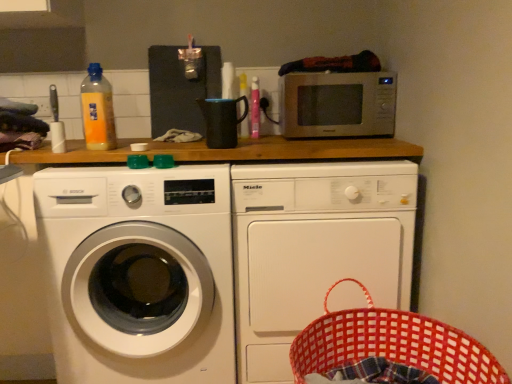
What do you see at coordinates (314, 248) in the screenshot? I see `white matte washing machine at center, which appears as the first washing machine when viewed from the right` at bounding box center [314, 248].

How much space does white glossy washing machine at left, arranged as the first washing machine when viewed from the left, occupy horizontally?

white glossy washing machine at left, arranged as the first washing machine when viewed from the left, is 86.07 centimeters in width.

The image size is (512, 384). In order to click on red woven basket at lower right in this screenshot , I will do `click(392, 344)`.

In the scene shown: Measure the distance between point (87, 128) and camera.

A distance of 4.69 feet exists between point (87, 128) and camera.

Locate an element on the screen. white matte washing machine at center, which appears as the first washing machine when viewed from the right is located at coordinates (314, 248).

Which of these two, red woven basket at lower right or satin silver microwave at upper center, is thinner?

satin silver microwave at upper center is thinner.

Considering the positions of objects red woven basket at lower right and satin silver microwave at upper center in the image provided, who is in front, red woven basket at lower right or satin silver microwave at upper center?

red woven basket at lower right is more forward.

Is red woven basket at lower right looking in the opposite direction of satin silver microwave at upper center?

red woven basket at lower right does not have its back to satin silver microwave at upper center.

From their relative heights in the image, would you say red woven basket at lower right is taller or shorter than satin silver microwave at upper center?

red woven basket at lower right is taller than satin silver microwave at upper center.

Which is behind, white matte washing machine at center, the 2th washing machine positioned from the left, or white glossy washing machine at left, arranged as the first washing machine when viewed from the left?

white matte washing machine at center, the 2th washing machine positioned from the left, is further from the camera.

Is white matte washing machine at center, which appears as the first washing machine when viewed from the right, oriented towards white glossy washing machine at left, arranged as the first washing machine when viewed from the left?

No.

From the image's perspective, who appears lower, white matte washing machine at center, the 2th washing machine positioned from the left, or white glossy washing machine at left, arranged as the first washing machine when viewed from the left?

white glossy washing machine at left, arranged as the first washing machine when viewed from the left.

From a real-world perspective, is white matte washing machine at center, the 2th washing machine positioned from the left, under white glossy washing machine at left, arranged as the first washing machine when viewed from the left?

Yes.

Which is more to the right, translucent plastic bottle at upper center, the 2th bottle from the front, or red woven basket at lower right?

red woven basket at lower right is more to the right.

Looking at their sizes, would you say translucent plastic bottle at upper center, the first bottle from the back, is wider or thinner than red woven basket at lower right?

Clearly, translucent plastic bottle at upper center, the first bottle from the back, has less width compared to red woven basket at lower right.

Is translucent plastic bottle at upper center, which ranks as the second bottle in left-to-right order, further to camera compared to red woven basket at lower right?

That is True.

From the image's perspective, relative to red woven basket at lower right, is translucent plastic bottle at upper center, the 2th bottle from the front, above or below?

Clearly, from the image's perspective, translucent plastic bottle at upper center, the 2th bottle from the front, is above red woven basket at lower right.

Which object is positioned more to the right, white matte washing machine at center, which appears as the first washing machine when viewed from the right, or satin silver microwave at upper center?

Positioned to the right is satin silver microwave at upper center.

Is white matte washing machine at center, which appears as the first washing machine when viewed from the right, completely or partially outside of satin silver microwave at upper center?

Yes, white matte washing machine at center, which appears as the first washing machine when viewed from the right, is located beyond the bounds of satin silver microwave at upper center.

Considering the positions of points (297, 183) and (374, 126), is point (297, 183) closer to camera compared to point (374, 126)?

Yes.

Can you tell me how much white matte washing machine at center, the 2th washing machine positioned from the left, and satin silver microwave at upper center differ in facing direction?

1.26 degrees separate the facing orientations of white matte washing machine at center, the 2th washing machine positioned from the left, and satin silver microwave at upper center.

Looking at their sizes, would you say translucent plastic bottle at upper center, marked as the first bottle in a right-to-left arrangement, is wider or thinner than yellow translucent bottle at upper left, which is counted as the first bottle, starting from the left?

In the image, translucent plastic bottle at upper center, marked as the first bottle in a right-to-left arrangement, appears to be more narrow than yellow translucent bottle at upper left, which is counted as the first bottle, starting from the left.

Is translucent plastic bottle at upper center, which ranks as the second bottle in left-to-right order, located outside yellow translucent bottle at upper left, the 2th bottle positioned from the right?

translucent plastic bottle at upper center, which ranks as the second bottle in left-to-right order, lies outside yellow translucent bottle at upper left, the 2th bottle positioned from the right,'s area.

Which object is more forward, translucent plastic bottle at upper center, the 2th bottle from the front, or yellow translucent bottle at upper left, which is the 1th bottle in front-to-back order?

yellow translucent bottle at upper left, which is the 1th bottle in front-to-back order, is more forward.

From a real-world perspective, which is physically above, translucent plastic bottle at upper center, the 2th bottle from the front, or yellow translucent bottle at upper left, which is counted as the first bottle, starting from the left?

From a 3D spatial view, yellow translucent bottle at upper left, which is counted as the first bottle, starting from the left, is above.

From the picture: Is satin silver microwave at upper center at the back of translucent plastic bottle at upper center, the 2th bottle from the front?

No, translucent plastic bottle at upper center, the 2th bottle from the front, is not facing away from satin silver microwave at upper center.

Does translucent plastic bottle at upper center, marked as the first bottle in a right-to-left arrangement, have a smaller size compared to satin silver microwave at upper center?

Indeed, translucent plastic bottle at upper center, marked as the first bottle in a right-to-left arrangement, has a smaller size compared to satin silver microwave at upper center.

Between translucent plastic bottle at upper center, which ranks as the second bottle in left-to-right order, and satin silver microwave at upper center, which one appears on the left side from the viewer's perspective?

translucent plastic bottle at upper center, which ranks as the second bottle in left-to-right order.

From a real-world perspective, is translucent plastic bottle at upper center, which ranks as the second bottle in left-to-right order, beneath white glossy washing machine at left, the 2th washing machine from the right?

No, from a real-world perspective, translucent plastic bottle at upper center, which ranks as the second bottle in left-to-right order, is not below white glossy washing machine at left, the 2th washing machine from the right.

Considering the sizes of objects translucent plastic bottle at upper center, the first bottle from the back, and white glossy washing machine at left, the 2th washing machine from the right, in the image provided, who is shorter, translucent plastic bottle at upper center, the first bottle from the back, or white glossy washing machine at left, the 2th washing machine from the right,?

With less height is translucent plastic bottle at upper center, the first bottle from the back.

How much distance is there between translucent plastic bottle at upper center, marked as the first bottle in a right-to-left arrangement, and white glossy washing machine at left, the 2th washing machine from the right?

translucent plastic bottle at upper center, marked as the first bottle in a right-to-left arrangement, is 31.25 inches from white glossy washing machine at left, the 2th washing machine from the right.

Is translucent plastic bottle at upper center, the first bottle from the back, directly adjacent to white glossy washing machine at left, the 2th washing machine from the right?

No, translucent plastic bottle at upper center, the first bottle from the back, is not making contact with white glossy washing machine at left, the 2th washing machine from the right.

Where is `microwave oven on the right side of red woven basket at lower right`? microwave oven on the right side of red woven basket at lower right is located at coordinates (337, 104).

There is a white matte washing machine at center, which appears as the first washing machine when viewed from the right. Find the location of `washing machine above it (from a real-world perspective)`. washing machine above it (from a real-world perspective) is located at coordinates (139, 273).

When comparing their distances from white matte washing machine at center, which appears as the first washing machine when viewed from the right, does red woven basket at lower right or white glossy washing machine at left, arranged as the first washing machine when viewed from the left, seem closer?

red woven basket at lower right is positioned closer to the anchor white matte washing machine at center, which appears as the first washing machine when viewed from the right.

Looking at the image, which one is located further to translucent plastic bottle at upper center, marked as the first bottle in a right-to-left arrangement, satin silver microwave at upper center or white matte washing machine at center, the 2th washing machine positioned from the left?

white matte washing machine at center, the 2th washing machine positioned from the left, is positioned further to the anchor translucent plastic bottle at upper center, marked as the first bottle in a right-to-left arrangement.

Estimate the real-world distances between objects in this image. Which object is closer to translucent plastic bottle at upper center, the 2th bottle from the front, white glossy washing machine at left, the 2th washing machine from the right, or red woven basket at lower right?

Based on the image, white glossy washing machine at left, the 2th washing machine from the right, appears to be nearer to translucent plastic bottle at upper center, the 2th bottle from the front.

Estimate the real-world distances between objects in this image. Which object is further from white glossy washing machine at left, the 2th washing machine from the right, red woven basket at lower right or translucent plastic bottle at upper center, which ranks as the second bottle in left-to-right order?

translucent plastic bottle at upper center, which ranks as the second bottle in left-to-right order, lies further to white glossy washing machine at left, the 2th washing machine from the right, than the other object.

When comparing their distances from red woven basket at lower right, does translucent plastic bottle at upper center, the first bottle from the back, or white glossy washing machine at left, arranged as the first washing machine when viewed from the left, seem closer?

Based on the image, white glossy washing machine at left, arranged as the first washing machine when viewed from the left, appears to be nearer to red woven basket at lower right.

From the image, which object appears to be farther from white glossy washing machine at left, arranged as the first washing machine when viewed from the left, white matte washing machine at center, which appears as the first washing machine when viewed from the right, or satin silver microwave at upper center?

Based on the image, satin silver microwave at upper center appears to be further to white glossy washing machine at left, arranged as the first washing machine when viewed from the left.

Consider the image. Looking at the image, which one is located further to translucent plastic bottle at upper center, marked as the first bottle in a right-to-left arrangement, red woven basket at lower right or yellow translucent bottle at upper left, which is counted as the first bottle, starting from the left?

Based on the image, red woven basket at lower right appears to be further to translucent plastic bottle at upper center, marked as the first bottle in a right-to-left arrangement.

Looking at the image, which one is located closer to white matte washing machine at center, which appears as the first washing machine when viewed from the right, translucent plastic bottle at upper center, the 2th bottle from the front, or red woven basket at lower right?

The object closer to white matte washing machine at center, which appears as the first washing machine when viewed from the right, is red woven basket at lower right.

In order to click on microwave oven positioned between red woven basket at lower right and translucent plastic bottle at upper center, the first bottle from the back, from near to far in this screenshot , I will do `click(337, 104)`.

Image resolution: width=512 pixels, height=384 pixels. In order to click on bottle between yellow translucent bottle at upper left, the 2th bottle positioned from the right, and white matte washing machine at center, which appears as the first washing machine when viewed from the right, from left to right in this screenshot , I will do `click(243, 85)`.

Locate an element on the screen. The width and height of the screenshot is (512, 384). washing machine between white glossy washing machine at left, arranged as the first washing machine when viewed from the left, and red woven basket at lower right is located at coordinates (314, 248).

Locate an element on the screen. microwave oven between translucent plastic bottle at upper center, marked as the first bottle in a right-to-left arrangement, and white glossy washing machine at left, the 2th washing machine from the right, vertically is located at coordinates (337, 104).